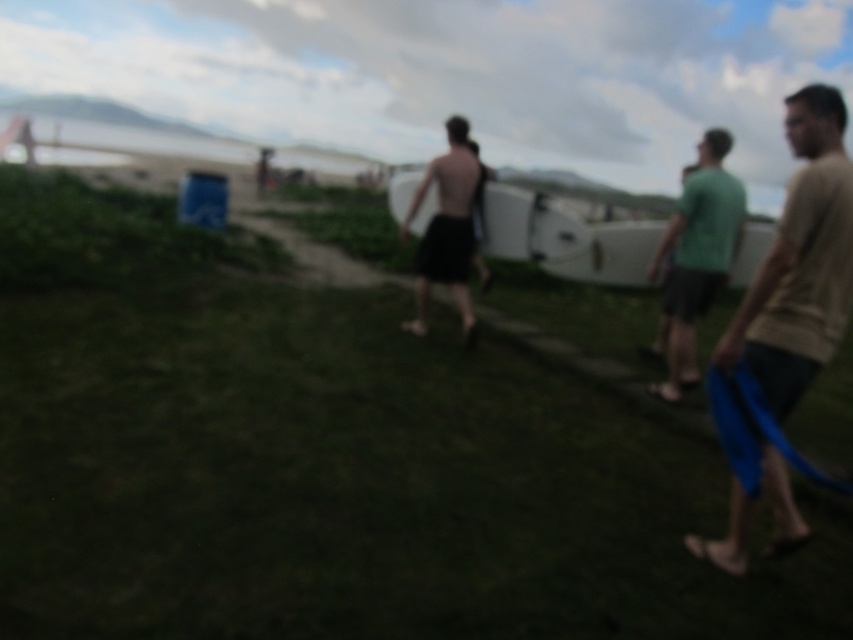
Who is positioned more to the left, green grassy at center or green matte shirt at right?

green grassy at center is more to the left.

Consider the image. Can you confirm if green grassy at center is positioned to the right of green matte shirt at right?

No, green grassy at center is not to the right of green matte shirt at right.

Is point (608, 499) closer to camera compared to point (697, 189)?

That is True.

Where is `green grassy at center`? green grassy at center is located at coordinates (329, 460).

How much distance is there between green grassy at center and black matte surfboard at center?

The distance of green grassy at center from black matte surfboard at center is 3.74 meters.

Is point (637, 531) positioned behind point (465, 140)?

No, (637, 531) is in front of (465, 140).

Measure the distance between point (x=437, y=536) and camera.

Point (x=437, y=536) is 3.33 meters away from camera.

Image resolution: width=853 pixels, height=640 pixels. I want to click on green grassy at center, so click(329, 460).

Between tan fabric shorts at right and black matte surfboard at center, which one appears on the left side from the viewer's perspective?

Positioned to the left is black matte surfboard at center.

Describe the element at coordinates (799, 264) in the screenshot. I see `tan fabric shorts at right` at that location.

Does point (796, 541) lie behind point (456, 291)?

No, (796, 541) is in front of (456, 291).

This screenshot has height=640, width=853. In order to click on tan fabric shorts at right in this screenshot , I will do `click(799, 264)`.